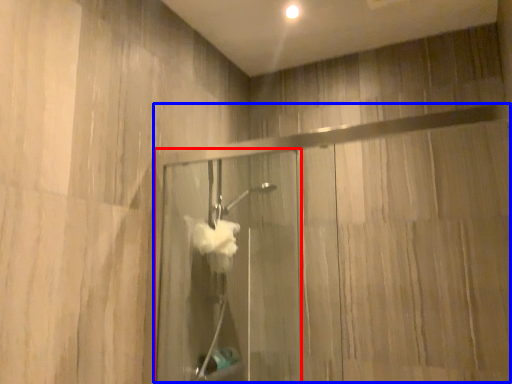
Question: Which object is closer to the camera taking this photo, screen door (highlighted by a red box) or glass door (highlighted by a blue box)?

Choices:
 (A) screen door
 (B) glass door

Answer: (B)